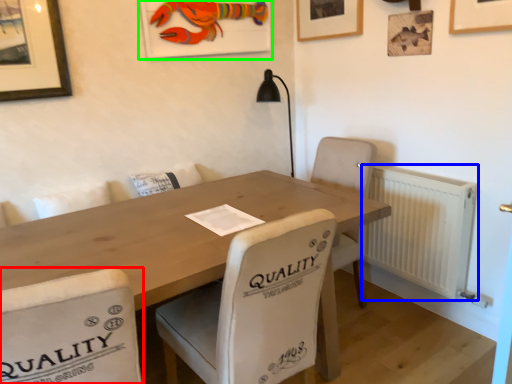
Question: Estimate the real-world distances between objects in this image. Which object is farther from chair (highlighted by a red box), radiator (highlighted by a blue box) or picture frame (highlighted by a green box)?

Choices:
 (A) radiator
 (B) picture frame

Answer: (B)